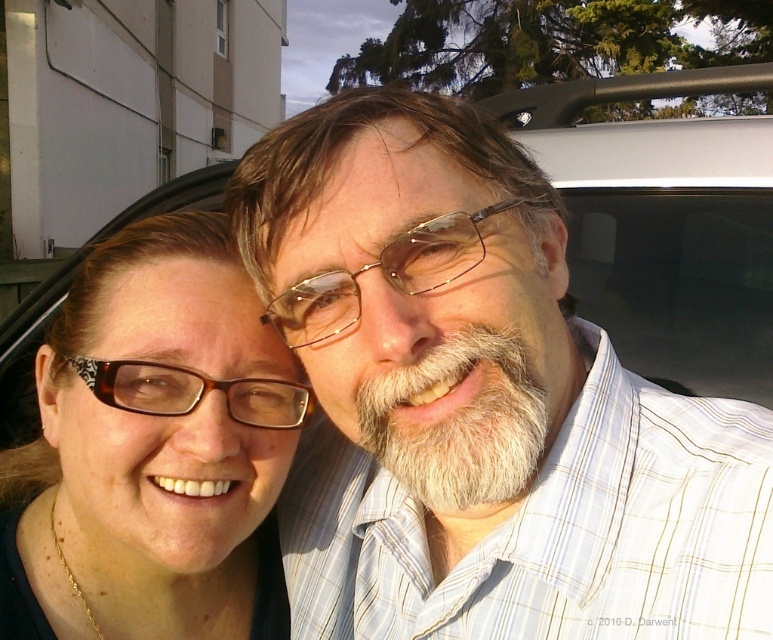
Question: Is matte black glasses at left to the right of metallic gold glasses at center from the viewer's perspective?

Choices:
 (A) yes
 (B) no

Answer: (B)

Question: Which point is closer to the camera?

Choices:
 (A) (499, 449)
 (B) (281, 604)

Answer: (A)

Question: Observing the image, what is the correct spatial positioning of transparent glass car window at upper center in reference to metallic gold glasses at center?

Choices:
 (A) right
 (B) left

Answer: (A)

Question: Among these points, which one is farthest from the camera?

Choices:
 (A) click(179, 371)
 (B) click(298, 289)

Answer: (A)

Question: Can you confirm if white fuzzy beard at center is positioned to the left of metallic gold glasses at center?

Choices:
 (A) yes
 (B) no

Answer: (B)

Question: Which object is closer to the camera taking this photo?

Choices:
 (A) matte black glasses at left
 (B) white striped shirt at center
 (C) white fuzzy beard at center
 (D) metallic gold glasses at center

Answer: (B)